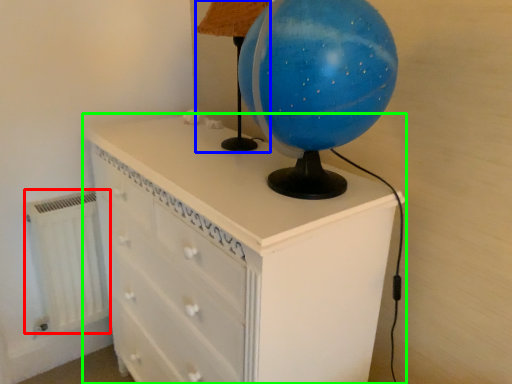
Question: Based on their relative distances, which object is nearer to radiator (highlighted by a red box)? Choose from table lamp (highlighted by a blue box) and chest of drawers (highlighted by a green box).

Choices:
 (A) table lamp
 (B) chest of drawers

Answer: (B)